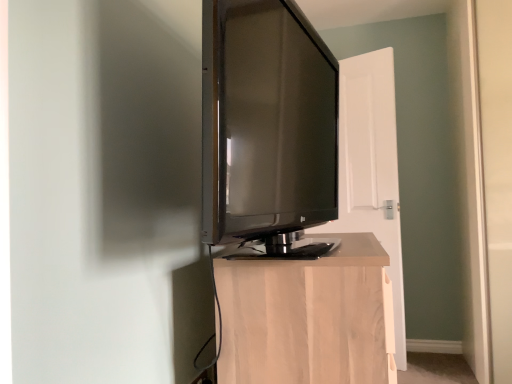
Question: Considering the relative sizes of white wood door at center and matte black tv at center in the image provided, is white wood door at center bigger than matte black tv at center?

Choices:
 (A) no
 (B) yes

Answer: (A)

Question: Is white wood door at center at the right side of matte black tv at center?

Choices:
 (A) yes
 (B) no

Answer: (A)

Question: Is white wood door at center next to matte black tv at center and touching it?

Choices:
 (A) yes
 (B) no

Answer: (B)

Question: From a real-world perspective, is white wood door at center positioned over matte black tv at center based on gravity?

Choices:
 (A) yes
 (B) no

Answer: (B)

Question: Can you confirm if white wood door at center is taller than matte black tv at center?

Choices:
 (A) no
 (B) yes

Answer: (B)

Question: From the image's perspective, is matte black tv at center located above or below light wood cabinet at center?

Choices:
 (A) below
 (B) above

Answer: (B)

Question: Considering the positions of matte black tv at center and light wood cabinet at center in the image, is matte black tv at center bigger or smaller than light wood cabinet at center?

Choices:
 (A) small
 (B) big

Answer: (A)

Question: From a real-world perspective, is matte black tv at center physically located above or below light wood cabinet at center?

Choices:
 (A) above
 (B) below

Answer: (A)

Question: Is matte black tv at center taller or shorter than light wood cabinet at center?

Choices:
 (A) tall
 (B) short

Answer: (A)

Question: Considering the positions of white wood door at center and matte black tv at center in the image, is white wood door at center taller or shorter than matte black tv at center?

Choices:
 (A) tall
 (B) short

Answer: (A)

Question: Is white wood door at center bigger or smaller than matte black tv at center?

Choices:
 (A) big
 (B) small

Answer: (B)

Question: Is point (376, 196) positioned closer to the camera than point (305, 39)?

Choices:
 (A) farther
 (B) closer

Answer: (A)

Question: Based on their positions, is white wood door at center located to the left or right of matte black tv at center?

Choices:
 (A) right
 (B) left

Answer: (A)

Question: Considering the relative positions of light wood cabinet at center and white wood door at center in the image provided, is light wood cabinet at center to the left or to the right of white wood door at center?

Choices:
 (A) left
 (B) right

Answer: (A)

Question: Is light wood cabinet at center wider or thinner than white wood door at center?

Choices:
 (A) thin
 (B) wide

Answer: (B)